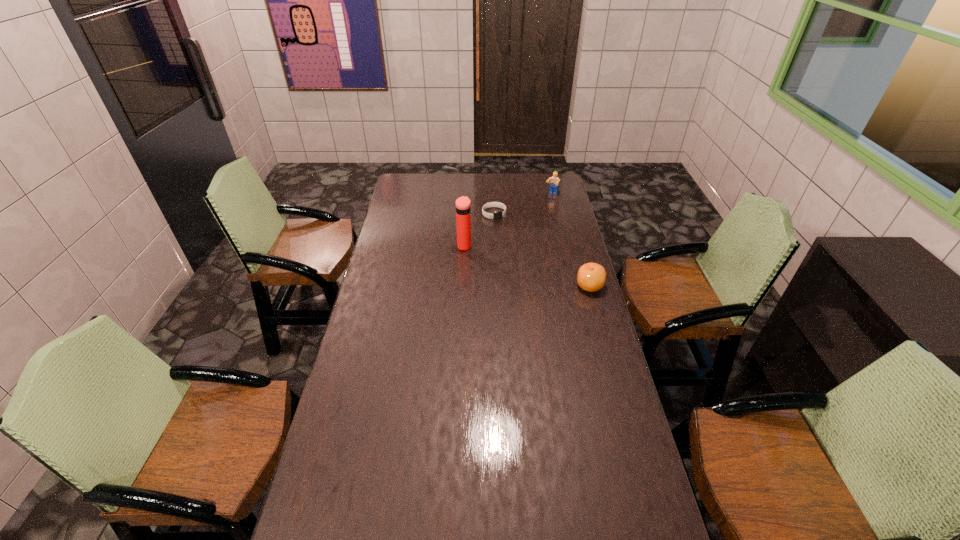
Identify the location of free space between the leftmost object and the Lego. (508, 220).

What are the coordinates of `vacant space that is in between the clementine and the farthest object` in the screenshot? It's located at (571, 240).

The width and height of the screenshot is (960, 540). Identify the location of free space between the wristband and the clementine. (542, 250).

You are a GUI agent. You are given a task and a screenshot of the screen. Output one action in this format:
    pyautogui.click(x=<x>, y=<y>)
    Task: Click on the free space between the leftmost object and the second shortest object
    The width and height of the screenshot is (960, 540).
    Given the screenshot: What is the action you would take?
    pyautogui.click(x=527, y=266)

Choose which object is the second nearest neighbor to the shortest object. Please provide its 2D coordinates. Your answer should be formatted as a tuple, i.e. [(x, y)], where the tuple contains the x and y coordinates of a point satisfying the conditions above.

[(554, 182)]

In order to click on object that ranks as the third closest to the shortest object in this screenshot , I will do `click(591, 277)`.

This screenshot has width=960, height=540. Identify the location of vacant area in the image that satisfies the following two spatial constraints: 1. on the front side of the second object from left to right; 2. on the left side of the second shortest object. (497, 286).